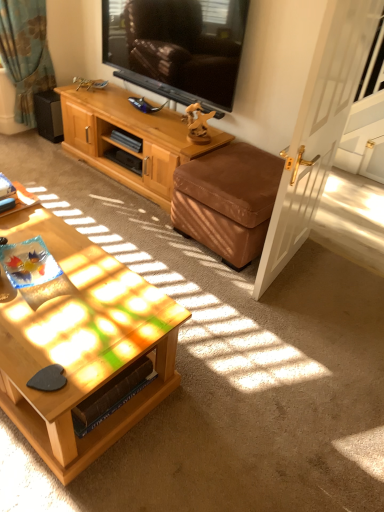
At what (x,y) coordinates should I click in order to perform the action: click on empty space that is ontop of wooden desk at lower left. Please return your answer as a coordinate pair (x, y). The height and width of the screenshot is (512, 384). Looking at the image, I should click on (15, 196).